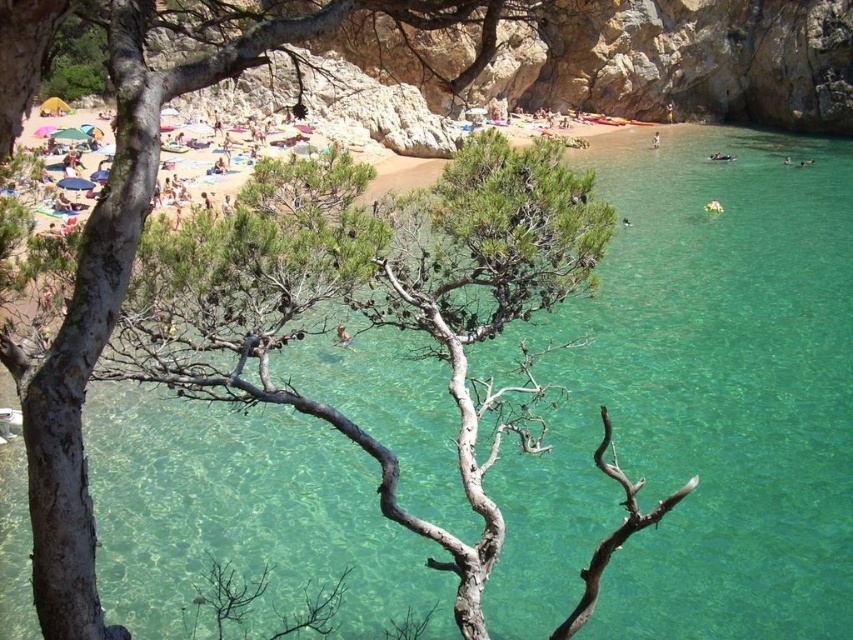
You are a photographer positioned at the edge of the beach, aiming to capture a photo of the smooth skin person at center and the dark blue swimwear at lower right. To ensure both subjects are in focus, you need to know their vertical positions relative to each other. Which object is positioned lower in the frame?

The smooth skin person at center is below dark blue swimwear at lower right, so the smooth skin person at center is positioned lower in the frame.

You are a photographer standing on the beach and want to capture a photo of both the dark blue swimwear at lower right and the white fabric person at lower right. Which object should you position closer to the right side of your camera frame to include both in the shot?

You should position the dark blue swimwear at lower right closer to the right side of your camera frame since it is already to the right of the white fabric person at lower right.